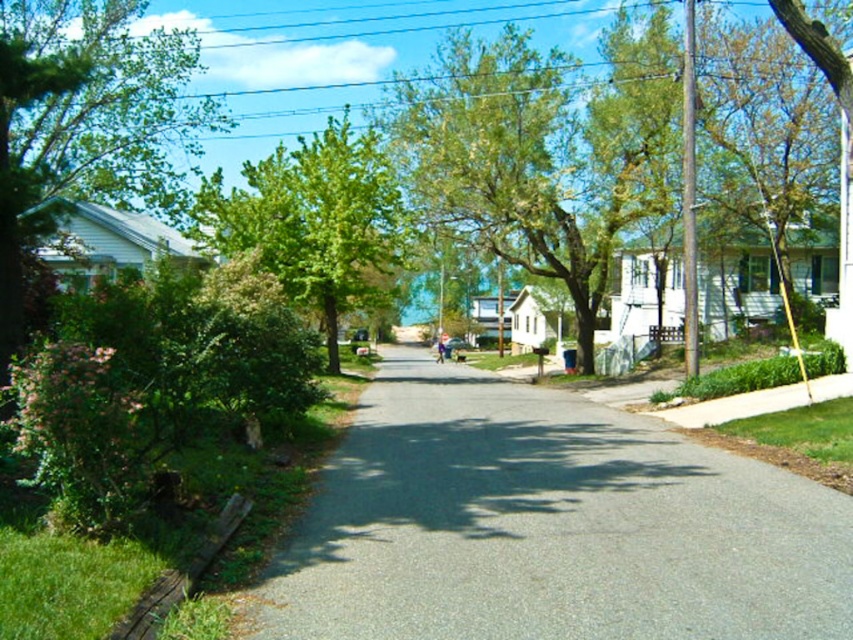
Which is above, gray asphalt road at center or green leafy tree at left?

green leafy tree at left is higher up.

Does gray asphalt road at center have a lesser width compared to green leafy tree at left?

Indeed, gray asphalt road at center has a lesser width compared to green leafy tree at left.

Measure the distance between point (334,477) and camera.

Point (334,477) and camera are 10.56 meters apart.

Locate an element on the screen. The image size is (853, 640). gray asphalt road at center is located at coordinates (547, 525).

Who is higher up, gray asphalt road at center or green leafy tree at center?

green leafy tree at center is higher up.

Is gray asphalt road at center taller than green leafy tree at center?

In fact, gray asphalt road at center may be shorter than green leafy tree at center.

Locate an element on the screen. This screenshot has height=640, width=853. gray asphalt road at center is located at coordinates pyautogui.click(x=547, y=525).

Based on the photo, can you confirm if green leafy tree at left is smaller than green leafy tree at center?

Actually, green leafy tree at left might be larger than green leafy tree at center.

Is point (126, 138) positioned after point (299, 193)?

No, (126, 138) is in front of (299, 193).

Is point (15, 301) in front of point (334, 314)?

Yes, it is.

Locate an element on the screen. green leafy tree at left is located at coordinates (84, 122).